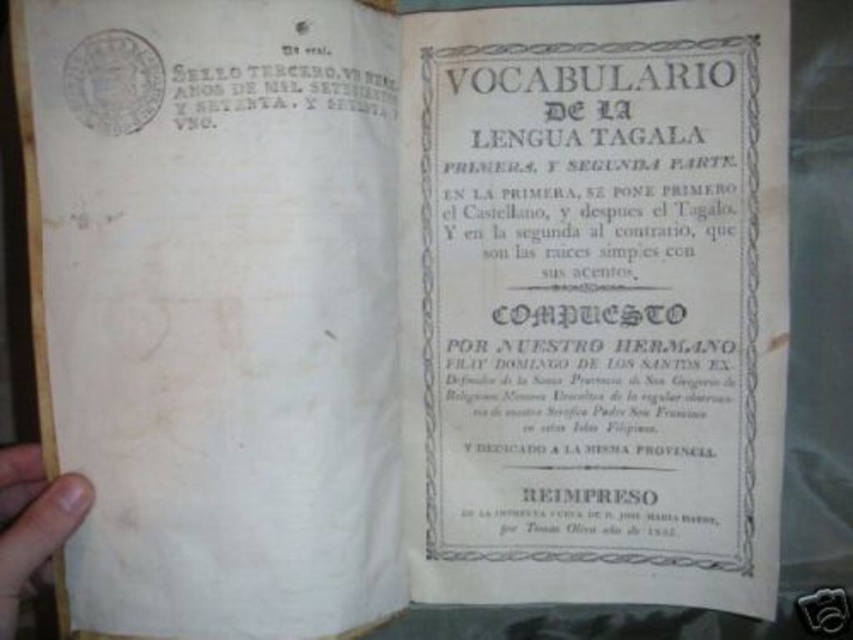
Question: Does white paper title page at center have a lesser width compared to brown wood at lower left?

Choices:
 (A) yes
 (B) no

Answer: (B)

Question: Which point is closer to the camera?

Choices:
 (A) brown wood at lower left
 (B) white paper title page at center

Answer: (A)

Question: Can you confirm if white paper title page at center is wider than brown wood at lower left?

Choices:
 (A) no
 (B) yes

Answer: (B)

Question: Can you confirm if white paper title page at center is positioned to the right of brown wood at lower left?

Choices:
 (A) yes
 (B) no

Answer: (A)

Question: Which of the following is the closest to the observer?

Choices:
 (A) brown wood at lower left
 (B) white paper title page at center

Answer: (A)